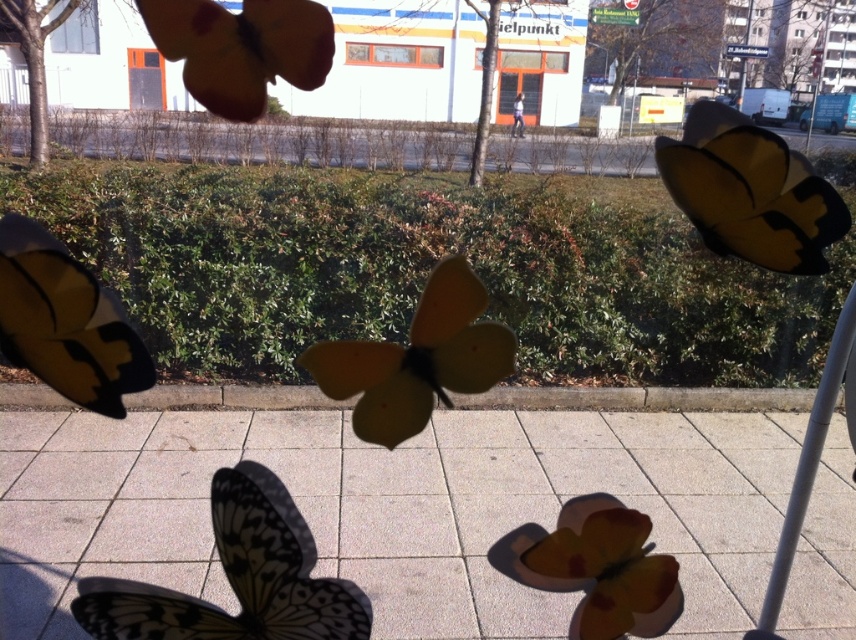
Based on the photo, does matte yellow butterfly at center appear on the right side of matte yellow butterfly at upper left?

Correct, you'll find matte yellow butterfly at center to the right of matte yellow butterfly at upper left.

Does point (391, 449) come farther from viewer compared to point (282, 29)?

No.

You are a GUI agent. You are given a task and a screenshot of the screen. Output one action in this format:
    pyautogui.click(x=<x>, y=<y>)
    Task: Click on the matte yellow butterfly at center
    
    Given the screenshot: What is the action you would take?
    pyautogui.click(x=417, y=358)

Who is taller, matte yellow butterfly at center or gray metallic pole at right?

With more height is gray metallic pole at right.

Does matte yellow butterfly at center have a lesser width compared to gray metallic pole at right?

Yes, matte yellow butterfly at center is thinner than gray metallic pole at right.

Identify the location of matte yellow butterfly at center. This screenshot has height=640, width=856. (417, 358).

Between point (37, 276) and point (183, 81), which one is positioned in front?

Point (37, 276) is in front.

Is matte yellow butterfly at left positioned at the back of matte yellow butterfly at upper left?

Yes, matte yellow butterfly at left is behind matte yellow butterfly at upper left.

Which is behind, point (13, 236) or point (204, 52)?

The point (204, 52) is more distant.

This screenshot has height=640, width=856. Identify the location of matte yellow butterfly at left. (64, 323).